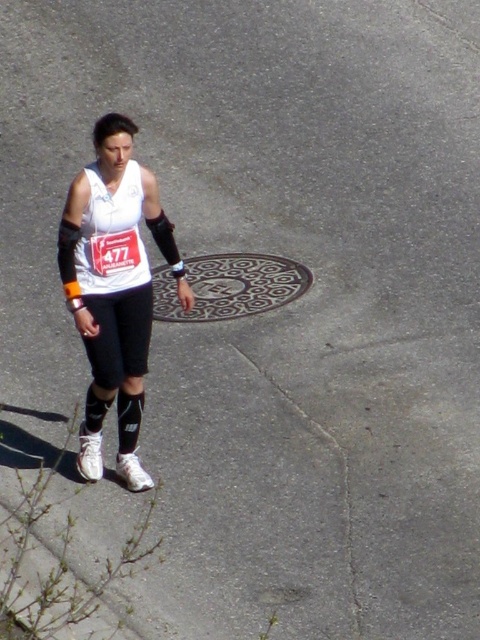
You are a photographer trying to capture the runner in the image. Since you want to focus on the runner, you need to adjust your camera to ensure the white matte tank top at center and the patterned metal manhole cover at center are in different focal planes. Which object should be closer to the camera lens?

The white matte tank top at center should be closer to the camera lens because it has a greater height compared to the patterned metal manhole cover at center, so adjusting the focal plane to prioritize it would keep the runner in focus while the manhole cover blurs slightly.

You are a photographer trying to capture the runner in the image. The runner is wearing a white matte tank top at center. You want to place a focus point at point (113, 289). Will this point be on the white matte tank top at center?

Yes, the point (113, 289) is on the white matte tank top at center, so placing the focus point there will ensure it lands on the desired area.

You are a photographer standing at the starting line of a marathon. You want to capture a photo of the white matte tank top at center and the patterned metal manhole cover at center. Which object is narrower?

The white matte tank top at center is narrower than the patterned metal manhole cover at center.